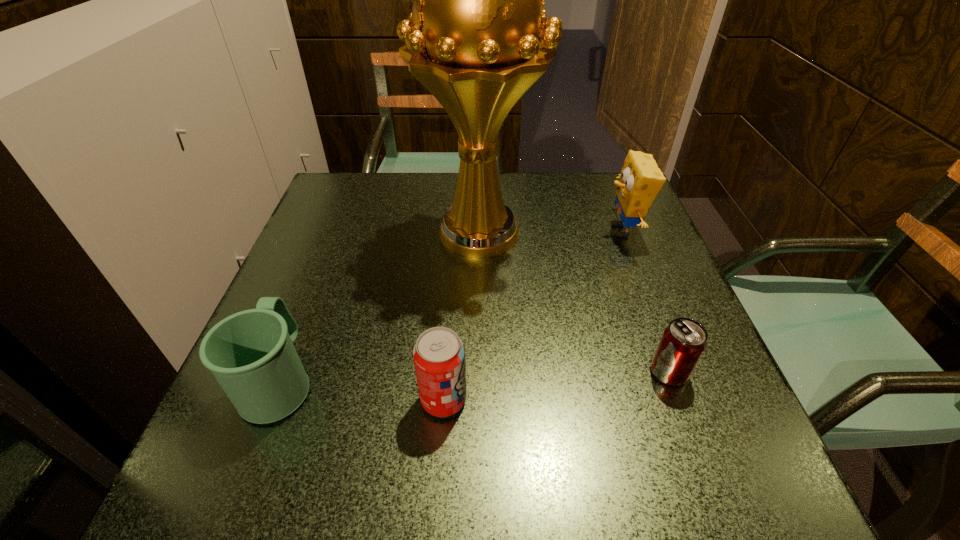
The width and height of the screenshot is (960, 540). In order to click on blank area in the image that satisfies the following two spatial constraints: 1. at the front of the right pop soda where the globe is prominent; 2. on the right side of the trophy_cup in this screenshot , I will do coord(479,372).

What are the coordinates of `free space that satisfies the following two spatial constraints: 1. at the front of the shortest object where the globe is prominent; 2. on the left side of the trophy_cup` in the screenshot? It's located at (479, 372).

In order to click on blank space that satisfies the following two spatial constraints: 1. at the front of the shorter pop soda where the globe is prominent; 2. on the left side of the tallest object in this screenshot , I will do `click(479, 372)`.